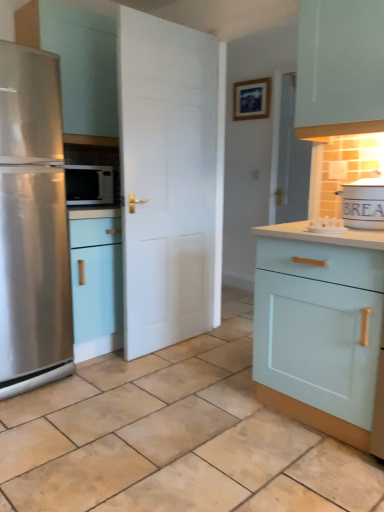
Locate an element on the screen. stainless steel refrigerator at left is located at coordinates (32, 223).

Measure the distance between point (x=87, y=202) and camera.

Point (x=87, y=202) is 2.57 meters from camera.

This screenshot has width=384, height=512. What do you see at coordinates (170, 179) in the screenshot?
I see `white matte door at center` at bounding box center [170, 179].

The height and width of the screenshot is (512, 384). In order to click on white matte door at center in this screenshot , I will do `click(170, 179)`.

What do you see at coordinates (175, 437) in the screenshot?
I see `beige tile at center` at bounding box center [175, 437].

The image size is (384, 512). What do you see at coordinates (363, 204) in the screenshot?
I see `white matte tin canister at upper right` at bounding box center [363, 204].

This screenshot has height=512, width=384. Identify the location of stainless steel refrigerator at left. (32, 223).

Considering the relative sizes of stainless steel refrigerator at left and white matte door at center in the image provided, is stainless steel refrigerator at left bigger than white matte door at center?

Correct, stainless steel refrigerator at left is larger in size than white matte door at center.

From a real-world perspective, is stainless steel refrigerator at left beneath white matte door at center?

Yes, from a real-world perspective, stainless steel refrigerator at left is under white matte door at center.

Which is in front, point (65, 237) or point (218, 163)?

The point (65, 237) is closer to the camera.

From the image's perspective, is stainless steel refrigerator at left beneath white matte door at center?

Yes.

Between satin black microwave at left and beige tile at center, which one has larger size?

beige tile at center is bigger.

From the image's perspective, is satin black microwave at left above or below beige tile at center?

Based on their image positions, satin black microwave at left is located above beige tile at center.

In terms of height, does satin black microwave at left look taller or shorter compared to beige tile at center?

Considering their sizes, satin black microwave at left has more height than beige tile at center.

Which of these two, satin black microwave at left or beige tile at center, is thinner?

Thinner between the two is satin black microwave at left.

Based on the photo, from the image's perspective, which one is positioned higher, white matte door at center or white matte tin canister at upper right?

white matte door at center is shown above in the image.

Is the position of white matte door at center less distant than that of white matte tin canister at upper right?

No, white matte door at center is further to the viewer.

Does white matte door at center have a lesser width compared to white matte tin canister at upper right?

Yes, white matte door at center is thinner than white matte tin canister at upper right.

Do you think white matte door at center is within white matte tin canister at upper right, or outside of it?

white matte door at center is located beyond the bounds of white matte tin canister at upper right.

Would you consider white matte tin canister at upper right to be distant from stainless steel refrigerator at left?

Indeed, white matte tin canister at upper right is not near stainless steel refrigerator at left.

From a real-world perspective, is white matte tin canister at upper right on stainless steel refrigerator at left?

Yes, from a real-world perspective, white matte tin canister at upper right is above stainless steel refrigerator at left.

Which is in front, white matte tin canister at upper right or stainless steel refrigerator at left?

white matte tin canister at upper right is more forward.

Does point (380, 211) appear closer or farther from the camera than point (5, 210)?

Clearly, point (380, 211) is closer to the camera than point (5, 210).

Would you consider white matte tin canister at upper right to be distant from white matte door at center?

Yes, white matte tin canister at upper right and white matte door at center are located far from each other.

Is white matte tin canister at upper right closer to camera compared to white matte door at center?

Yes, the depth of white matte tin canister at upper right is less than that of white matte door at center.

Which of these two, white matte tin canister at upper right or white matte door at center, is smaller?

white matte tin canister at upper right is smaller.

Between white matte tin canister at upper right and white matte door at center, which one has less height?

With less height is white matte tin canister at upper right.

Based on the photo, is white matte door at center with satin black microwave at left?

white matte door at center is not next to satin black microwave at left, and they're not touching.

Is point (141, 56) closer to viewer compared to point (106, 182)?

Yes.

Identify the location of door below the satin black microwave at left (from a real-world perspective). This screenshot has height=512, width=384. (170, 179).

Can you tell me how much white matte door at center and satin black microwave at left differ in facing direction?

1.19 degrees separate the facing orientations of white matte door at center and satin black microwave at left.

Between point (350, 460) and point (90, 186), which one is positioned behind?

Point (90, 186)

Considering the relative sizes of beige tile at center and satin black microwave at left in the image provided, is beige tile at center smaller than satin black microwave at left?

Incorrect, beige tile at center is not smaller in size than satin black microwave at left.

Do you think beige tile at center is within satin black microwave at left, or outside of it?

beige tile at center is spatially situated outside satin black microwave at left.

From the picture: Measure the distance between beige tile at center and satin black microwave at left.

beige tile at center is 4.12 feet away from satin black microwave at left.

Find the location of `door lying on the right of stainless steel refrigerator at left`. door lying on the right of stainless steel refrigerator at left is located at coordinates (170, 179).

At what (x,y) coordinates should I click in order to perform the action: click on microwave oven positioned vertically above the beige tile at center (from a real-world perspective). Please return your answer as a coordinate pair (x, y). The width and height of the screenshot is (384, 512). Looking at the image, I should click on (89, 185).

Consider the image. Looking at the image, which one is located further to white matte tin canister at upper right, white matte door at center or light blue wood cabinet at right?

The object further to white matte tin canister at upper right is white matte door at center.

Which object lies further to the anchor point light blue wood cabinet at right, stainless steel refrigerator at left or beige tile at center?

stainless steel refrigerator at left is positioned further to the anchor light blue wood cabinet at right.

Considering their positions, is white matte tin canister at upper right positioned closer to beige tile at center than stainless steel refrigerator at left?

stainless steel refrigerator at left is closer to beige tile at center.

Estimate the real-world distances between objects in this image. Which object is further from white matte door at center, light blue wood cabinet at right or beige tile at center?

light blue wood cabinet at right lies further to white matte door at center than the other object.

Which object lies nearer to the anchor point light blue wood cabinet at right, white matte tin canister at upper right or white matte door at center?

The object closer to light blue wood cabinet at right is white matte tin canister at upper right.

Based on their spatial positions, is light blue wood cabinet at right or white matte door at center further from stainless steel refrigerator at left?

Based on the image, light blue wood cabinet at right appears to be further to stainless steel refrigerator at left.

From the image, which object appears to be farther from white matte tin canister at upper right, satin black microwave at left or beige tile at center?

satin black microwave at left lies further to white matte tin canister at upper right than the other object.

When comparing their distances from white matte door at center, does beige tile at center or white matte tin canister at upper right seem closer?

beige tile at center is closer to white matte door at center.

Where is `tile situated between stainless steel refrigerator at left and light blue wood cabinet at right from left to right`? The height and width of the screenshot is (512, 384). tile situated between stainless steel refrigerator at left and light blue wood cabinet at right from left to right is located at coordinates pyautogui.click(x=175, y=437).

Image resolution: width=384 pixels, height=512 pixels. Identify the location of cabinetry situated between satin black microwave at left and white matte tin canister at upper right from left to right. (319, 326).

Locate an element on the screen. refrigerator located between beige tile at center and satin black microwave at left in the depth direction is located at coordinates (32, 223).

Where is `microwave oven between stainless steel refrigerator at left and white matte tin canister at upper right in the horizontal direction`? microwave oven between stainless steel refrigerator at left and white matte tin canister at upper right in the horizontal direction is located at coordinates (89, 185).